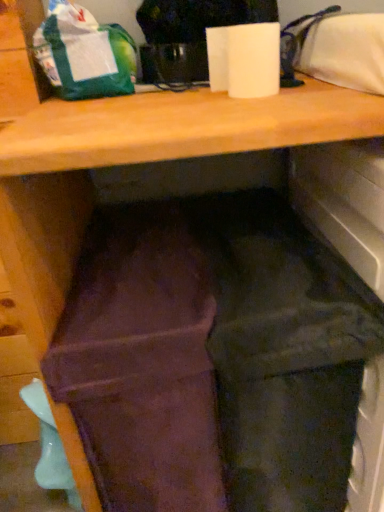
Question: Considering the relative sizes of brown suede wallet at center and white matte paper towel at upper center in the image provided, is brown suede wallet at center bigger than white matte paper towel at upper center?

Choices:
 (A) no
 (B) yes

Answer: (B)

Question: From a real-world perspective, is brown suede wallet at center below white matte paper towel at upper center?

Choices:
 (A) no
 (B) yes

Answer: (B)

Question: Would you say brown suede wallet at center contains white matte paper towel at upper center?

Choices:
 (A) no
 (B) yes

Answer: (A)

Question: Does brown suede wallet at center turn towards white matte paper towel at upper center?

Choices:
 (A) no
 (B) yes

Answer: (A)

Question: Can you confirm if brown suede wallet at center is smaller than white matte paper towel at upper center?

Choices:
 (A) no
 (B) yes

Answer: (A)

Question: From the image's perspective, is brown suede wallet at center under white matte paper towel at upper center?

Choices:
 (A) yes
 (B) no

Answer: (A)

Question: Does green matte bag at upper left come behind matte teal plastic spoon at lower left?

Choices:
 (A) no
 (B) yes

Answer: (A)

Question: Can you confirm if green matte bag at upper left is positioned to the left of matte teal plastic spoon at lower left?

Choices:
 (A) yes
 (B) no

Answer: (B)

Question: From the image's perspective, is green matte bag at upper left above matte teal plastic spoon at lower left?

Choices:
 (A) no
 (B) yes

Answer: (B)

Question: Does green matte bag at upper left have a greater height compared to matte teal plastic spoon at lower left?

Choices:
 (A) no
 (B) yes

Answer: (A)

Question: Is green matte bag at upper left facing away from matte teal plastic spoon at lower left?

Choices:
 (A) yes
 (B) no

Answer: (B)

Question: Would you say green matte bag at upper left is outside matte teal plastic spoon at lower left?

Choices:
 (A) no
 (B) yes

Answer: (B)

Question: From the image's perspective, would you say white matte paper towel at upper center is shown under green matte bag at upper left?

Choices:
 (A) yes
 (B) no

Answer: (A)